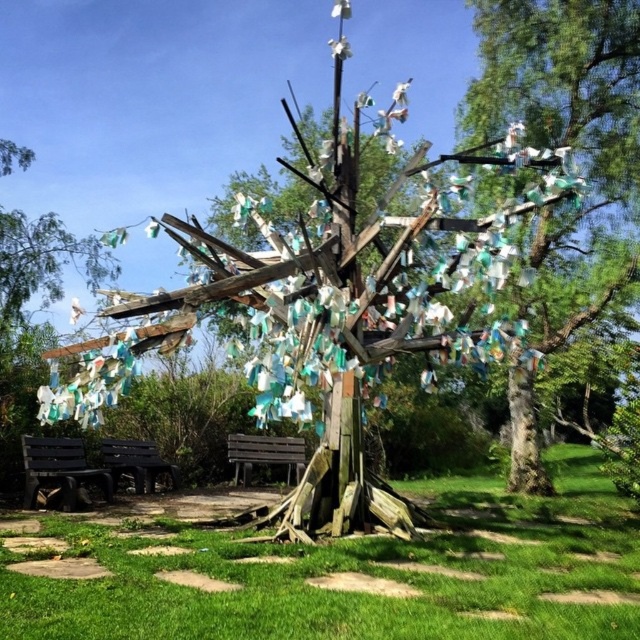
Question: Observing the image, what is the correct spatial positioning of black wooden bench at lower left in reference to dark brown wooden bench at lower left?

Choices:
 (A) right
 (B) left

Answer: (B)

Question: In this image, where is brown wooden bench at center located relative to dark brown wooden bench at lower left?

Choices:
 (A) left
 (B) right

Answer: (B)

Question: Which object appears closest to the camera in this image?

Choices:
 (A) black wooden bench at lower left
 (B) brown wooden bench at center
 (C) dark brown wooden bench at lower left

Answer: (A)

Question: Which of the following is the farthest from the observer?

Choices:
 (A) (29, 470)
 (B) (241, 468)
 (C) (122, 472)

Answer: (B)

Question: Is black wooden bench at lower left in front of brown wooden bench at center?

Choices:
 (A) yes
 (B) no

Answer: (A)

Question: Which object is positioned farthest from the black wooden bench at lower left?

Choices:
 (A) dark brown wooden bench at lower left
 (B) brown wooden bench at center

Answer: (B)